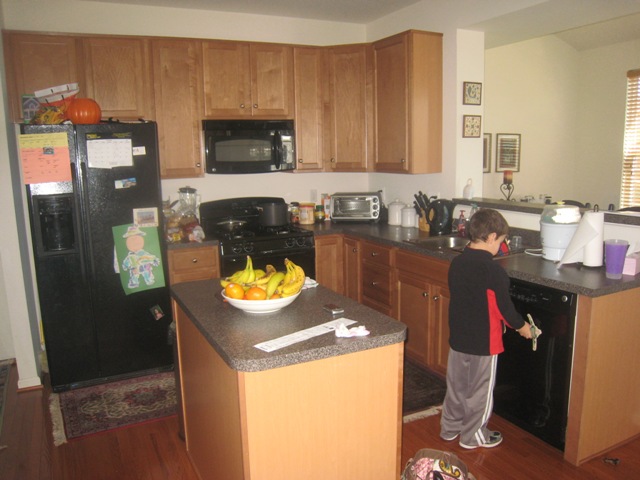
The image size is (640, 480). In order to click on rug in this screenshot , I will do `click(82, 409)`.